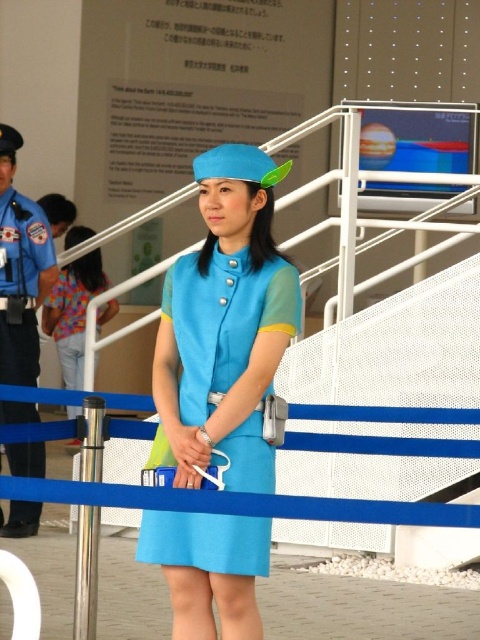
Consider the image. You are standing in front of the blue barrier and want to locate the blue uniform at left. According to the coordinates provided, where should you look to find it?

The blue uniform at left is located at coordinates point (21, 269).

You are a tailor who needs to adjust the length of two uniforms. You have a matte blue dress at center and a blue uniform at left. Which one requires more fabric to lengthen to match the other?

The matte blue dress at center is shorter than the blue uniform at left, so to match the blue uniform at left, the matte blue dress at center would require more fabric.